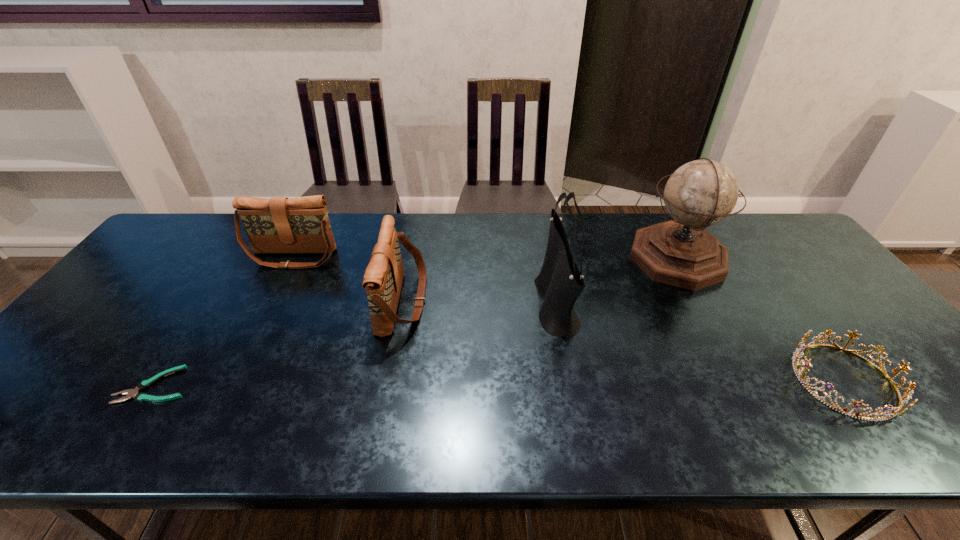
Identify the location of blank region between the third object from right to left and the pliers. (356, 346).

Identify the location of empty location between the globe and the pliers. The width and height of the screenshot is (960, 540). tap(416, 322).

You are a GUI agent. You are given a task and a screenshot of the screen. Output one action in this format:
    pyautogui.click(x=<x>, y=<y>)
    Task: Click on the unoccupied position between the tallest shoulder bag and the shortest object
    The width and height of the screenshot is (960, 540).
    Given the screenshot: What is the action you would take?
    pyautogui.click(x=356, y=346)

What are the coordinates of `free space between the shortest object and the fifth tallest object` in the screenshot? It's located at (499, 383).

What are the coordinates of `vacant area between the fifth tallest object and the shortest object` in the screenshot? It's located at (499, 383).

Identify the location of object that stands as the closest to the fourth object from right to left. (279, 225).

At what (x,y) coordinates should I click in order to perform the action: click on the third closest object to the tallest shoulder bag. Please return your answer as a coordinate pair (x, y). The image size is (960, 540). Looking at the image, I should click on (907, 395).

Find the location of a particular element. the second closest shoulder bag to the pliers is located at coordinates (383, 278).

Find the location of `the closest shoulder bag to the fifth tallest object`. the closest shoulder bag to the fifth tallest object is located at coordinates (560, 282).

At what (x,y) coordinates should I click in order to perform the action: click on vacant space that satisfies the following two spatial constraints: 1. on the front-facing side of the second shoulder bag from right to left; 2. on the left side of the fourth object from left to right. Please return your answer as a coordinate pair (x, y). The width and height of the screenshot is (960, 540). Looking at the image, I should click on (402, 306).